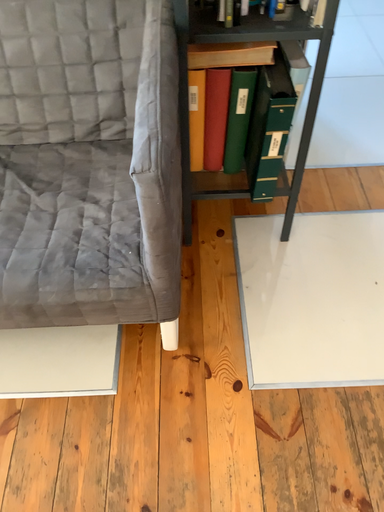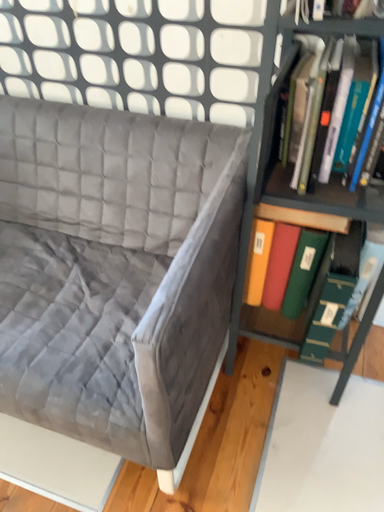
Question: Which way did the camera rotate in the video?

Choices:
 (A) rotated upward
 (B) rotated downward

Answer: (A)